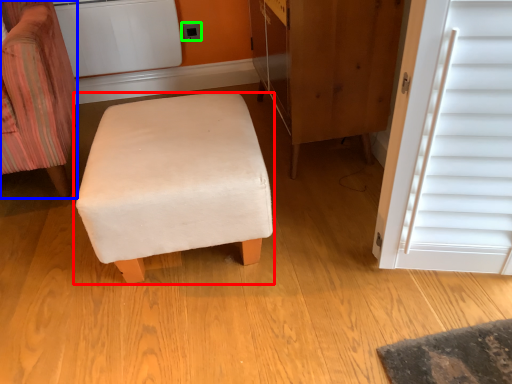
Question: Which object is the farthest from furniture (highlighted by a red box)? Choose among these: chair (highlighted by a blue box) or electric outlet (highlighted by a green box).

Choices:
 (A) chair
 (B) electric outlet

Answer: (B)